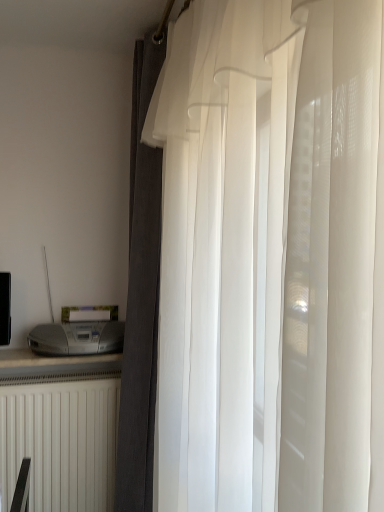
Question: In terms of height, does satin silver printer at lower left look taller or shorter compared to translucent white curtain at center, positioned as the 1th curtain in front-to-back order?

Choices:
 (A) tall
 (B) short

Answer: (B)

Question: Is satin silver printer at lower left wider or thinner than translucent white curtain at center, positioned as the 1th curtain in front-to-back order?

Choices:
 (A) wide
 (B) thin

Answer: (A)

Question: Which of these objects is positioned farthest from the satin silver printer at lower left?

Choices:
 (A) dark gray textured curtain at center, arranged as the 1th curtain when viewed from the back
 (B) translucent white curtain at center, the second curtain from the back
 (C) white matte radiator at lower left

Answer: (B)

Question: Which of these objects is positioned farthest from the translucent white curtain at center, the second curtain from the back?

Choices:
 (A) satin silver printer at lower left
 (B) dark gray textured curtain at center, arranged as the 1th curtain when viewed from the back
 (C) white matte radiator at lower left

Answer: (C)